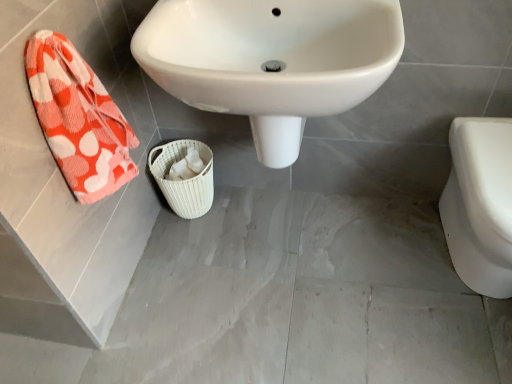
Image resolution: width=512 pixels, height=384 pixels. Identify the location of blank area beneath white glossy sink at center (from a real-world perspective). (278, 236).